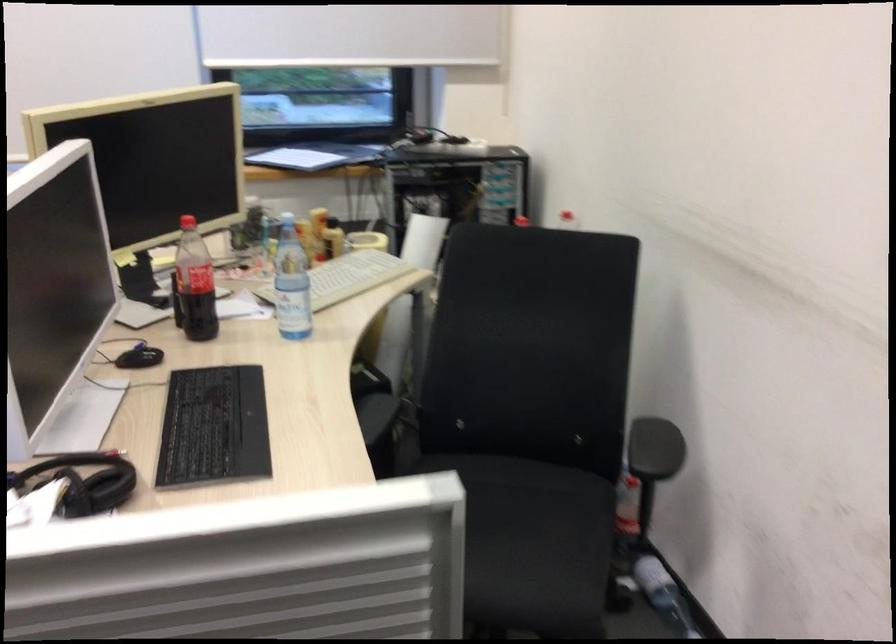
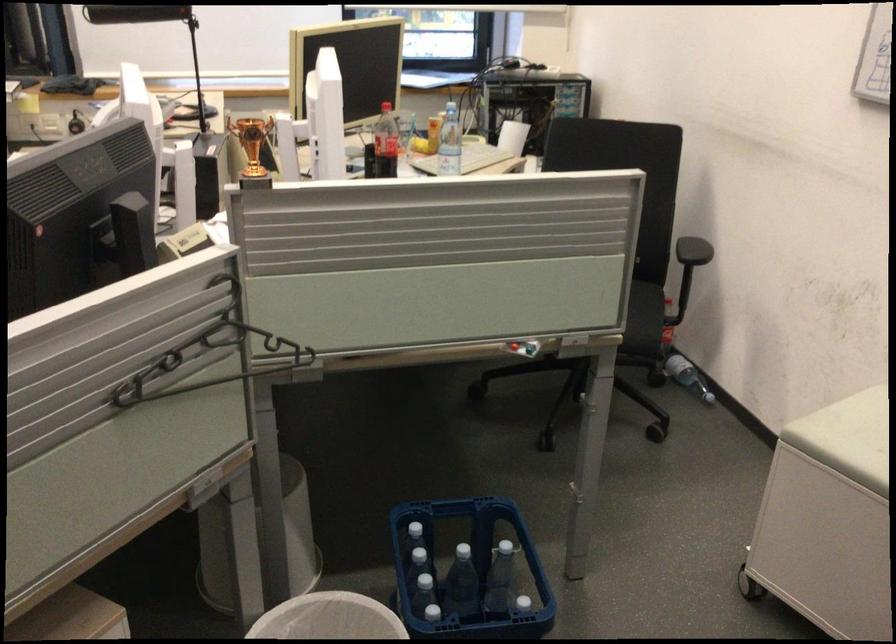
The point at (202, 279) is marked in the first image. Where is the corresponding point in the second image?

(385, 143)